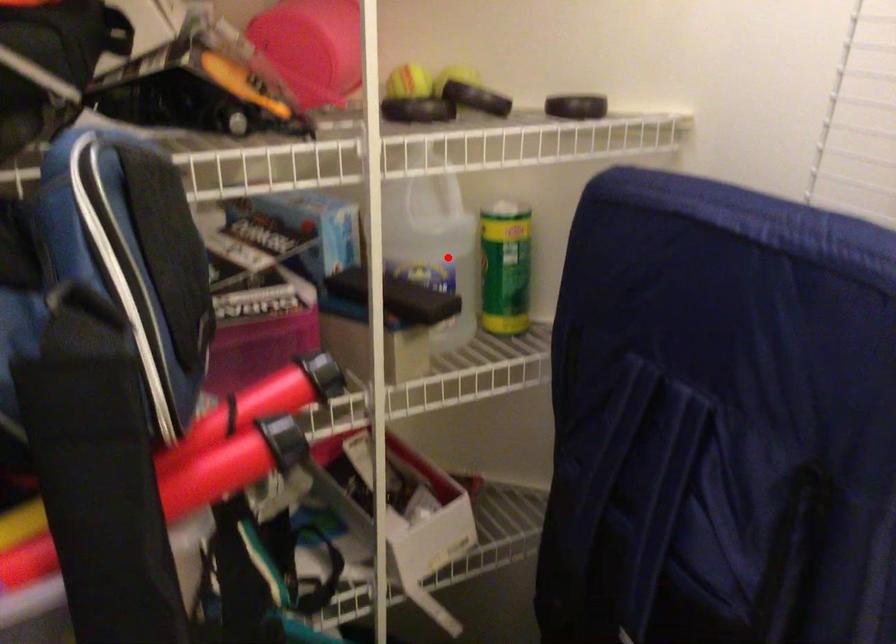
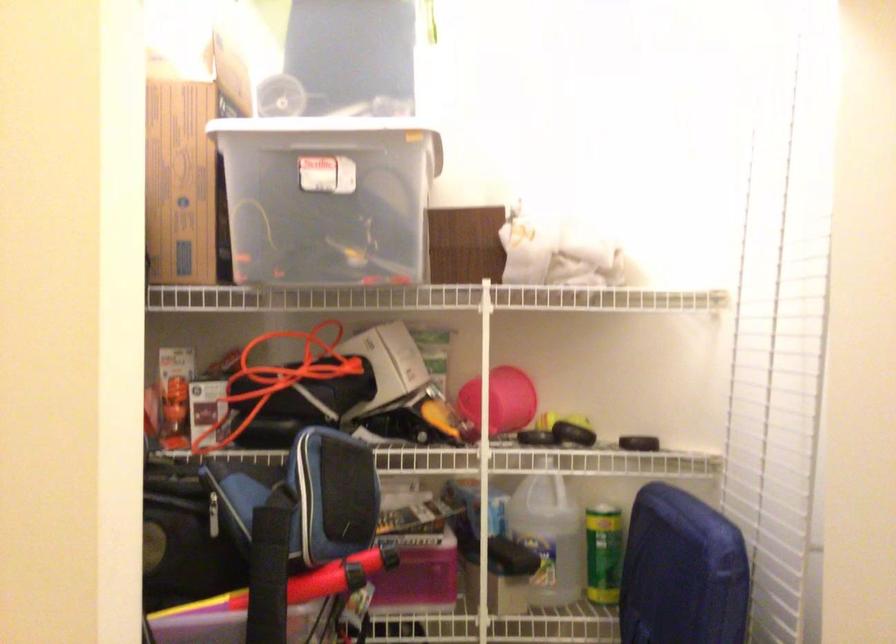
In the second image, find the point that corresponds to the highlighted location in the first image.

(548, 536)